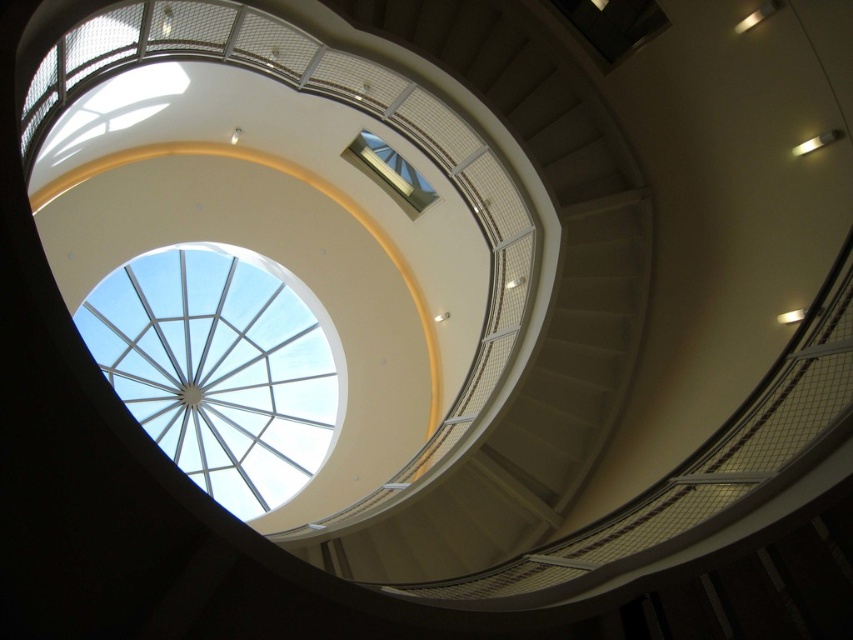
Question: From the image, what is the correct spatial relationship of white matte staircase at center in relation to transparent glass dome at upper center?

Choices:
 (A) left
 (B) right

Answer: (B)

Question: Which point appears closest to the camera in this image?

Choices:
 (A) (412, 180)
 (B) (514, 134)
 (C) (183, 416)

Answer: (B)

Question: Which point is farther to the camera?

Choices:
 (A) white matte staircase at center
 (B) clear glass window at upper center
 (C) transparent glass dome at upper center

Answer: (C)

Question: Is white matte staircase at center positioned behind transparent glass dome at upper center?

Choices:
 (A) yes
 (B) no

Answer: (B)

Question: Is transparent glass dome at upper center in front of clear glass window at upper center?

Choices:
 (A) yes
 (B) no

Answer: (B)

Question: Which object is the closest to the transparent glass dome at upper center?

Choices:
 (A) clear glass window at upper center
 (B) white matte staircase at center

Answer: (A)